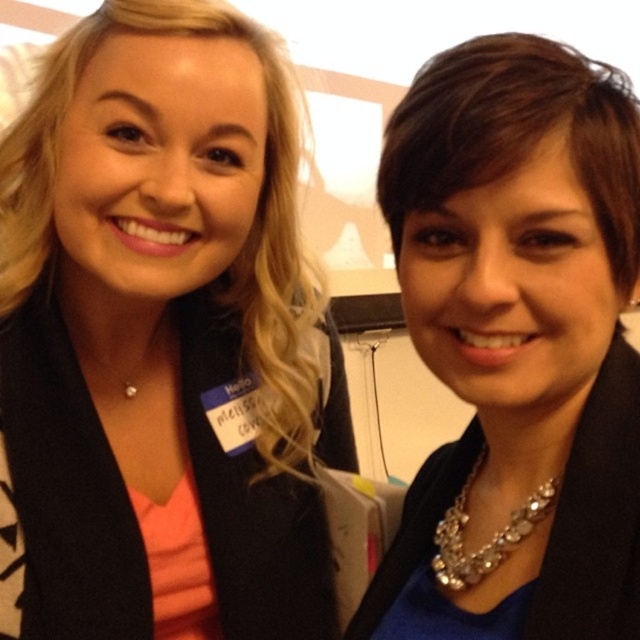
Question: Can you confirm if matte black blazer at center is thinner than sparkly silver necklace at lower right?

Choices:
 (A) yes
 (B) no

Answer: (B)

Question: Among these points, which one is nearest to the camera?

Choices:
 (A) (276, 620)
 (B) (433, 534)
 (C) (525, 177)

Answer: (C)

Question: Considering the real-world distances, which object is farthest from the matte black blazer at center?

Choices:
 (A) sparkly silver necklace at center
 (B) sparkly silver necklace at lower right

Answer: (B)

Question: From the image, what is the correct spatial relationship of matte black blazer at center in relation to sparkly silver necklace at center?

Choices:
 (A) above
 (B) below

Answer: (A)

Question: Can you confirm if sparkly silver necklace at center is bigger than sparkly silver necklace at lower right?

Choices:
 (A) yes
 (B) no

Answer: (A)

Question: Which of the following is the farthest from the observer?

Choices:
 (A) sparkly silver necklace at center
 (B) sparkly silver necklace at lower right

Answer: (B)